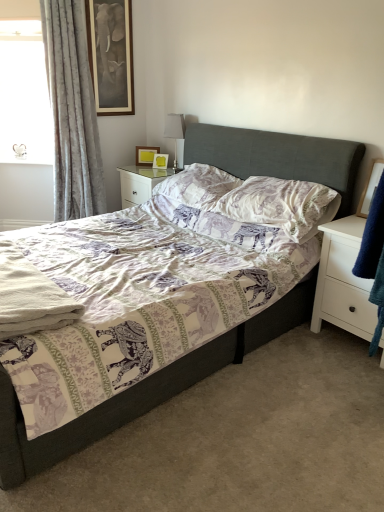
Question: Can you confirm if silky gray curtain at left is positioned to the left of printed fabric pillow at center, acting as the 2th pillow starting from the back?

Choices:
 (A) no
 (B) yes

Answer: (B)

Question: Is printed fabric pillow at center, which is counted as the 1th pillow, starting from the front, located within silky gray curtain at left?

Choices:
 (A) yes
 (B) no

Answer: (B)

Question: From a real-world perspective, is silky gray curtain at left located beneath printed fabric pillow at center, acting as the 2th pillow starting from the back?

Choices:
 (A) no
 (B) yes

Answer: (A)

Question: From the image's perspective, is silky gray curtain at left under printed fabric pillow at center, which is counted as the 1th pillow, starting from the front?

Choices:
 (A) yes
 (B) no

Answer: (B)

Question: From the image's perspective, is silky gray curtain at left above printed fabric pillow at center, which is counted as the 1th pillow, starting from the front?

Choices:
 (A) no
 (B) yes

Answer: (B)

Question: Looking at the image, does white matte nightstand at lower right, which is the 1th nightstand in front-to-back order, seem bigger or smaller compared to satin silver table lamp at upper center?

Choices:
 (A) big
 (B) small

Answer: (A)

Question: Visually, is white matte nightstand at lower right, the second nightstand positioned from the left, positioned to the left or to the right of satin silver table lamp at upper center?

Choices:
 (A) right
 (B) left

Answer: (A)

Question: In terms of width, does white matte nightstand at lower right, the 1th nightstand in the bottom-to-top sequence, look wider or thinner when compared to satin silver table lamp at upper center?

Choices:
 (A) wide
 (B) thin

Answer: (A)

Question: From the image's perspective, is white matte nightstand at lower right, the second nightstand positioned from the left, positioned above or below satin silver table lamp at upper center?

Choices:
 (A) below
 (B) above

Answer: (A)

Question: In terms of width, does purple elephant-patterned pillow at center, arranged as the first pillow when viewed from the back, look wider or thinner when compared to wooden picture frame at right, the second picture frame from the left?

Choices:
 (A) wide
 (B) thin

Answer: (A)

Question: Considering their positions, is purple elephant-patterned pillow at center, arranged as the first pillow when viewed from the back, located in front of or behind wooden picture frame at right, the 1th picture frame from the bottom?

Choices:
 (A) behind
 (B) front

Answer: (A)

Question: Is point (180, 190) closer or farther from the camera than point (370, 184)?

Choices:
 (A) farther
 (B) closer

Answer: (A)

Question: From the image's perspective, is purple elephant-patterned pillow at center, arranged as the first pillow when viewed from the back, located above or below wooden picture frame at right, positioned as the first picture frame in front-to-back order?

Choices:
 (A) below
 (B) above

Answer: (B)

Question: Based on their positions, is printed fabric pillow at center, which is counted as the 1th pillow, starting from the front, located to the left or right of satin silver table lamp at upper center?

Choices:
 (A) left
 (B) right

Answer: (B)

Question: Considering the positions of printed fabric pillow at center, which is counted as the 1th pillow, starting from the front, and satin silver table lamp at upper center in the image, is printed fabric pillow at center, which is counted as the 1th pillow, starting from the front, wider or thinner than satin silver table lamp at upper center?

Choices:
 (A) wide
 (B) thin

Answer: (A)